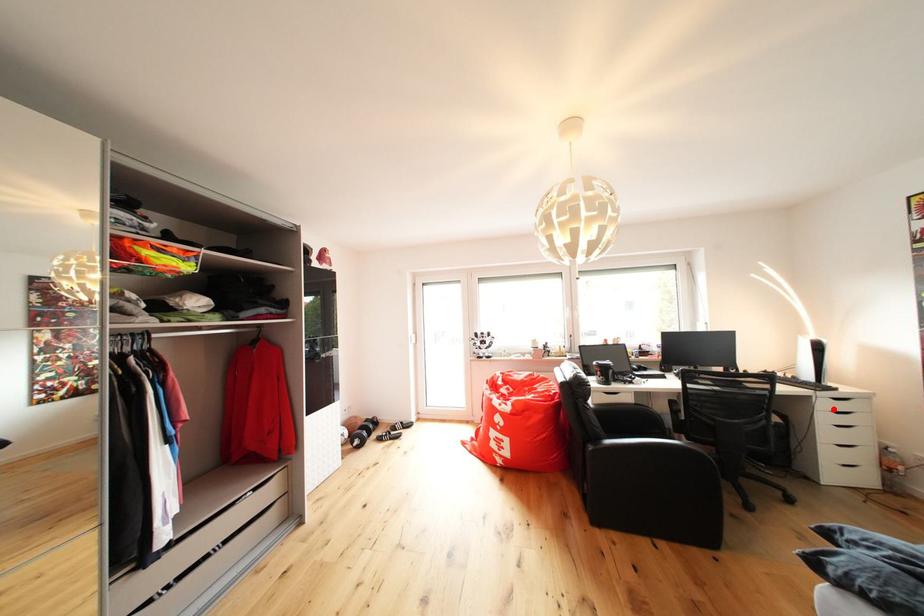
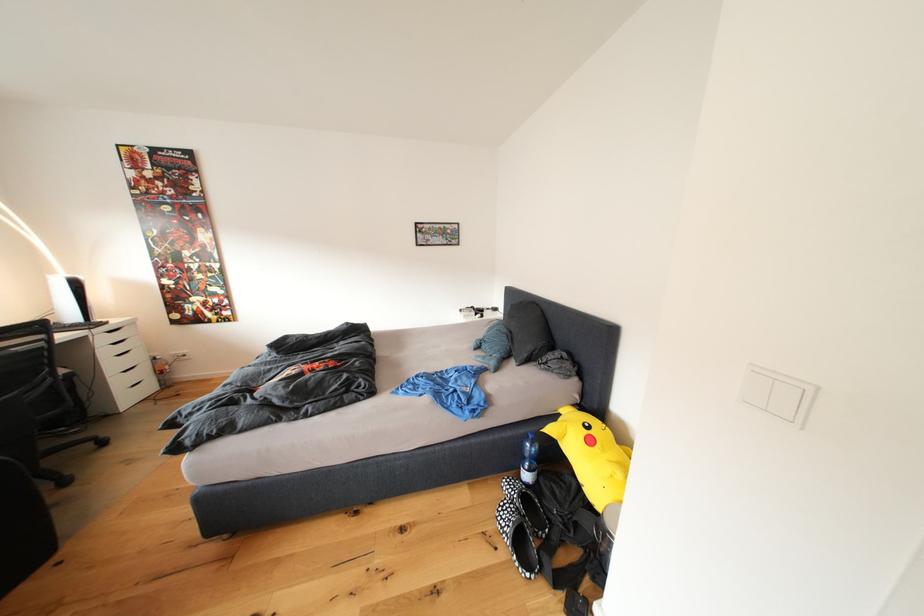
Locate, in the second image, the point that corresponds to the highlighted location in the first image.

(111, 344)